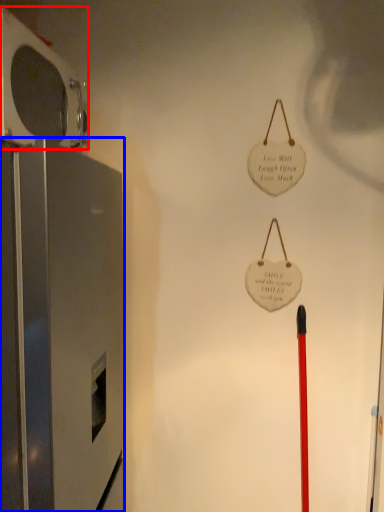
Question: Which object appears farthest to the camera in this image, appliance (highlighted by a red box) or appliance (highlighted by a blue box)?

Choices:
 (A) appliance
 (B) appliance

Answer: (A)